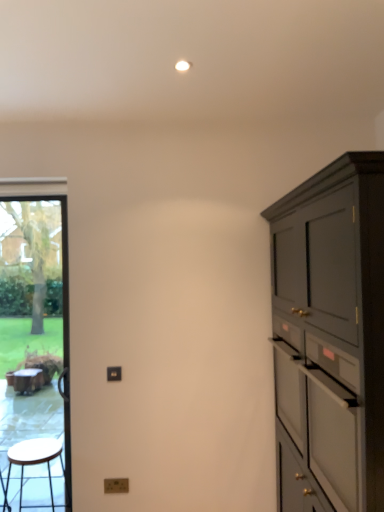
Question: In terms of size, does white matte drawer at right appear bigger or smaller than wooden stool at left?

Choices:
 (A) small
 (B) big

Answer: (B)

Question: Is white matte drawer at right taller or shorter than wooden stool at left?

Choices:
 (A) short
 (B) tall

Answer: (B)

Question: Which object is the farthest from the white matte drawer at right?

Choices:
 (A) wooden stool at left
 (B) transparent glass door at left
 (C) matte dark gray cabinet at right

Answer: (B)

Question: Estimate the real-world distances between objects in this image. Which object is closer to the transparent glass door at left?

Choices:
 (A) wooden stool at left
 (B) matte dark gray cabinet at right
 (C) white matte drawer at right

Answer: (A)